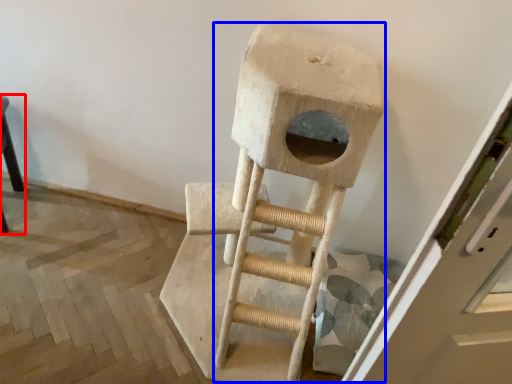
Question: Which point is further to the camera, furniture (highlighted by a red box) or ladder (highlighted by a blue box)?

Choices:
 (A) furniture
 (B) ladder

Answer: (A)